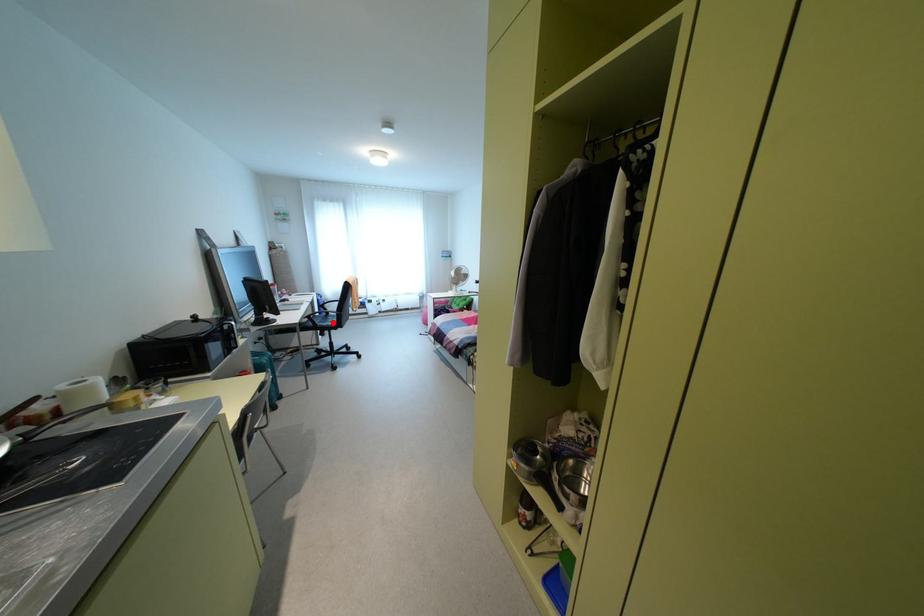
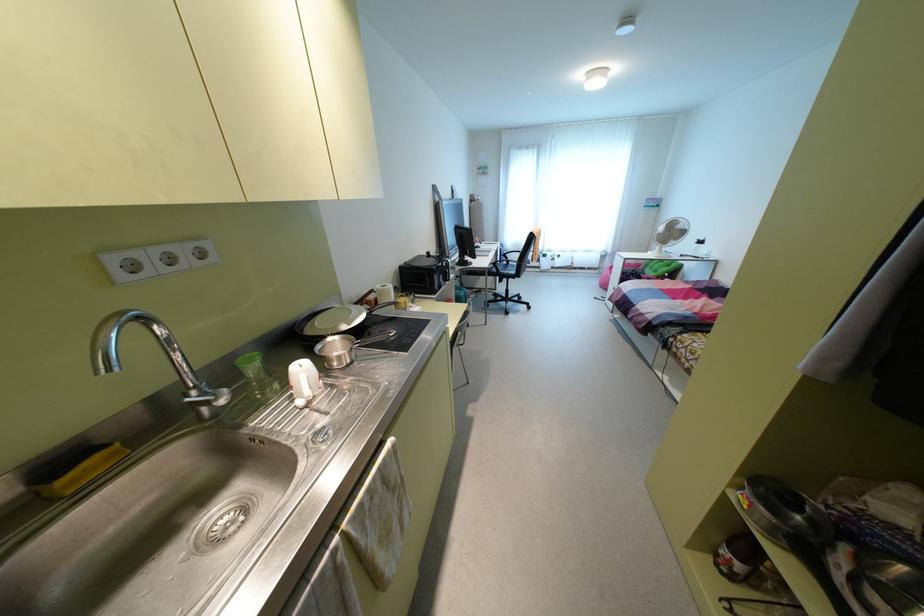
Question: I am providing you with two images of the same scene from different viewpoints. A red point is shown in image1. For the corresponding object point in image2, is it positioned nearer or farther from the camera?

Choices:
 (A) Nearer
 (B) Farther

Answer: (B)